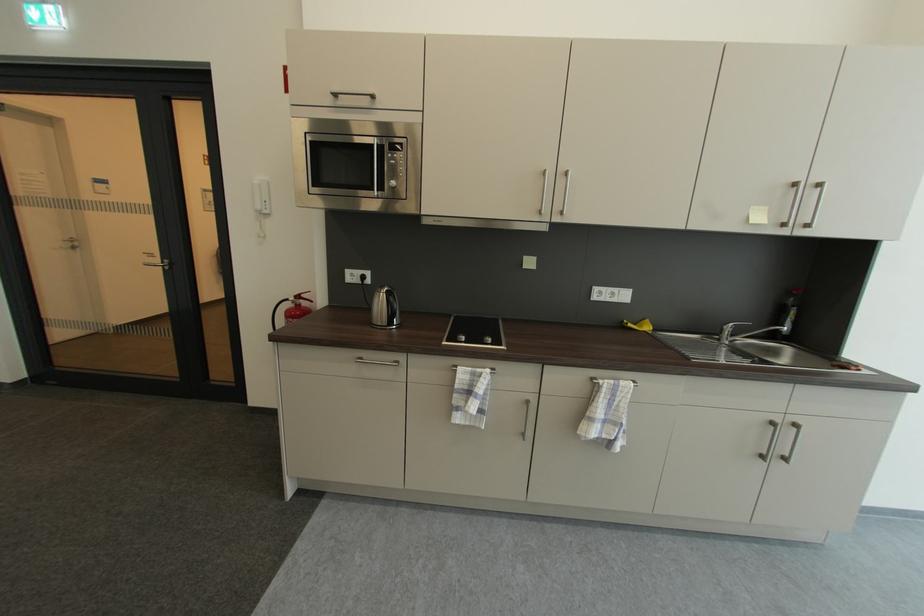
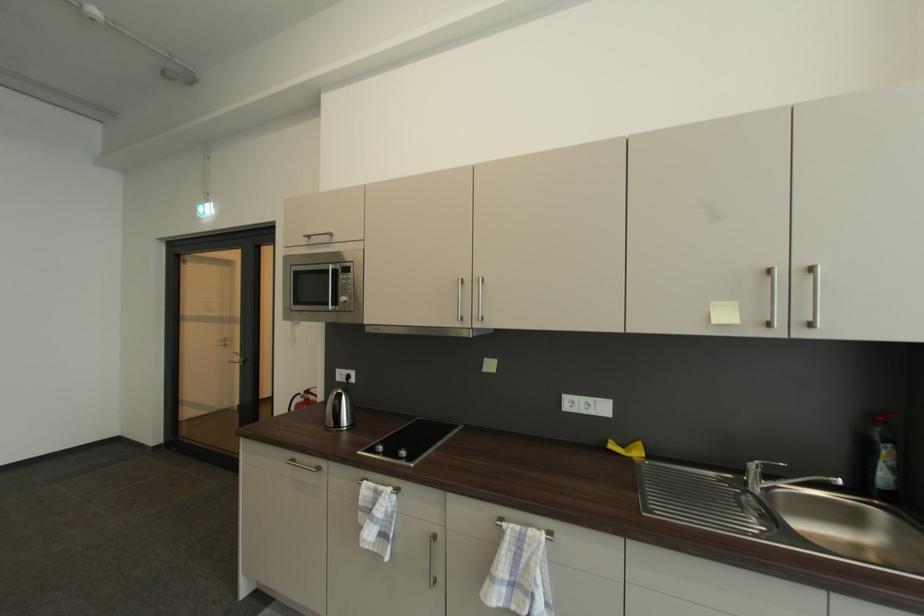
Find the pixel in the second image that matches pixel 305 299 in the first image.

(314, 392)